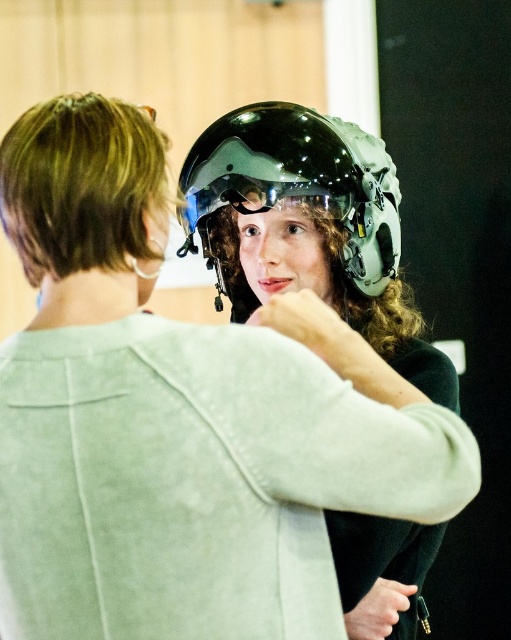
Which is in front, point (212, 156) or point (263, 209)?

Point (263, 209)

Is matte black helmet at center positioned in front of transparent plastic goggles at center?

Yes, it is in front of transparent plastic goggles at center.

Find the location of a particular element. matte black helmet at center is located at coordinates point(293,188).

Find the location of `matte black helmet at center`. matte black helmet at center is located at coordinates (293, 188).

In the scene shown: Does glossy black helmet at center appear on the right side of transparent plastic goggles at center?

Yes, glossy black helmet at center is to the right of transparent plastic goggles at center.

Does glossy black helmet at center appear under transparent plastic goggles at center?

Correct, glossy black helmet at center is located below transparent plastic goggles at center.

Does point (289, 141) come in front of point (243, 195)?

That is True.

Where is `glossy black helmet at center`? The image size is (511, 640). glossy black helmet at center is located at coordinates (310, 228).

Between glossy black helmet at center and matte black helmet at center, which one is positioned lower?

glossy black helmet at center is lower down.

Is glossy black helmet at center smaller than matte black helmet at center?

Incorrect, glossy black helmet at center is not smaller in size than matte black helmet at center.

The width and height of the screenshot is (511, 640). I want to click on glossy black helmet at center, so click(x=310, y=228).